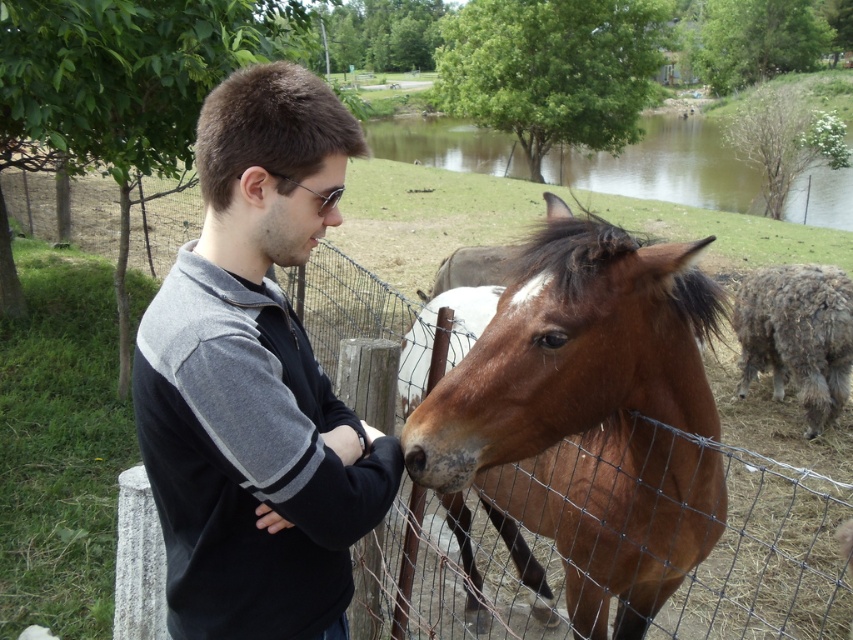
Where is the black fleece jacket at center located in the image?

The black fleece jacket at center is located at point 0.595 in the x coordinate and 0.301 in the y coordinate.

You are standing at the center of the image and want to approach the brown glossy horse at center. Which direction should you move in to reach it?

The brown glossy horse at center is located at point 0.659 on the x and 0.682 on the y axis. Since you are at the center, you should move towards the right and slightly upwards to reach the horse.